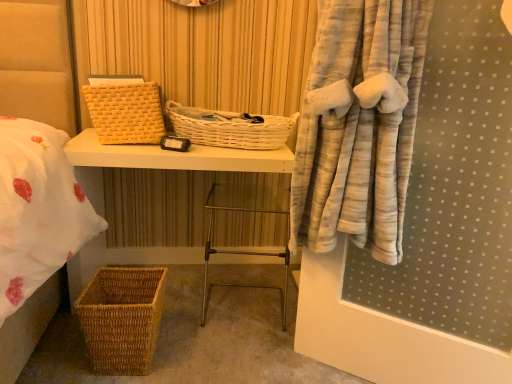
This screenshot has height=384, width=512. What are the coordinates of `vacant space in front of metallic silver step stool at center` in the screenshot? It's located at (240, 353).